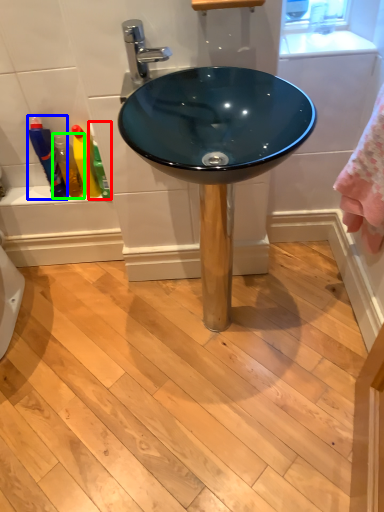
Question: Based on their relative distances, which object is farther from cleaning product (highlighted by a red box)? Choose from bottle (highlighted by a blue box) and toiletry (highlighted by a green box).

Choices:
 (A) bottle
 (B) toiletry

Answer: (A)